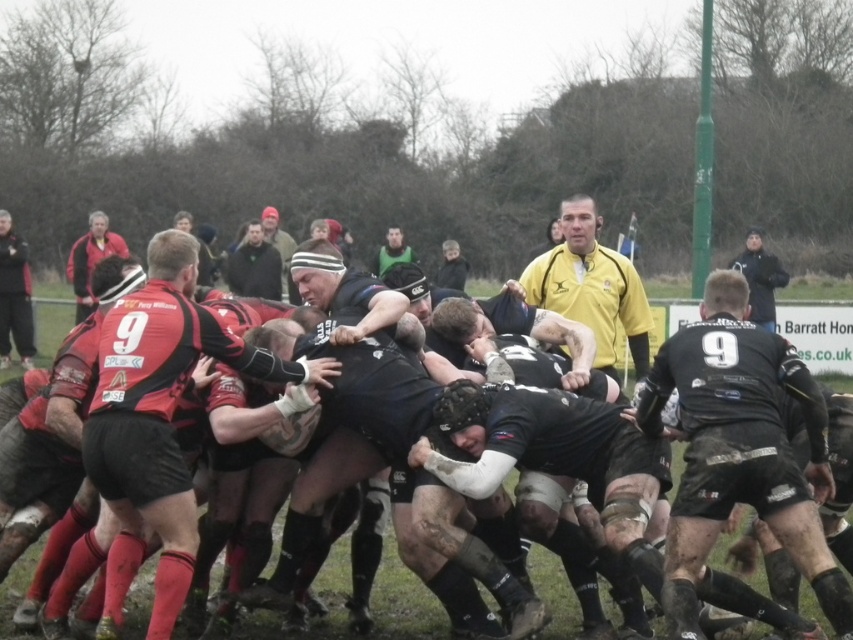
Question: Which object is positioned closest to the dark gray sweater at upper center?

Choices:
 (A) black matte jersey at right
 (B) red jersey at center

Answer: (B)

Question: Where is dark gray sweater at upper center located in relation to green matte jersey at center in the image?

Choices:
 (A) above
 (B) below

Answer: (B)

Question: Does red jersey at center have a smaller size compared to dark gray sweater at upper center?

Choices:
 (A) yes
 (B) no

Answer: (A)

Question: Estimate the real-world distances between objects in this image. Which object is closer to the red jersey at center?

Choices:
 (A) green matte jersey at center
 (B) red jersey at left
 (C) dark gray sweater at upper center
 (D) yellow jersey at center

Answer: (D)

Question: Among these points, which one is nearest to the camera?

Choices:
 (A) (9, 259)
 (B) (108, 465)

Answer: (B)

Question: Does red jersey at center appear under yellow jersey at center?

Choices:
 (A) no
 (B) yes

Answer: (B)